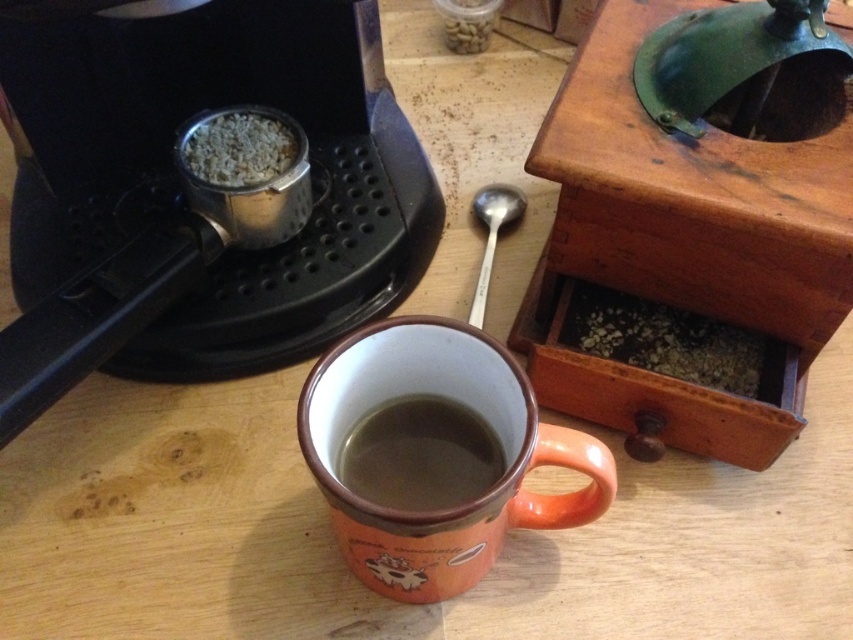
You are a barista preparing a latte and need to place the brown matte mug at center and the silver metallic spoon at center on the counter. According to the image, where should you position the spoon relative to the mug?

The brown matte mug at center is located below the silver metallic spoon at center, so you should place the spoon above the mug.

You are a barista trying to place two stickers on the coffee machine. The first sticker should be placed at point (x=573, y=464) and the second at (x=405, y=500). Since you want the stickers to be visible from above, which point should you choose?

Point (x=573, y=464) is closer to the camera than point (x=405, y=500), so the sticker placed at point (x=573, y=464) will be more visible from above.

You are a barista preparing drinks and need to place the orange ceramic mug at center and the brown matte mug at center on a shelf. The shelf has limited depth. Which mug should you place closer to the front of the shelf to ensure both mugs are visible?

The orange ceramic mug at center should be placed closer to the front of the shelf since it is already in front of the brown matte mug at center in the image, maintaining visibility for both.